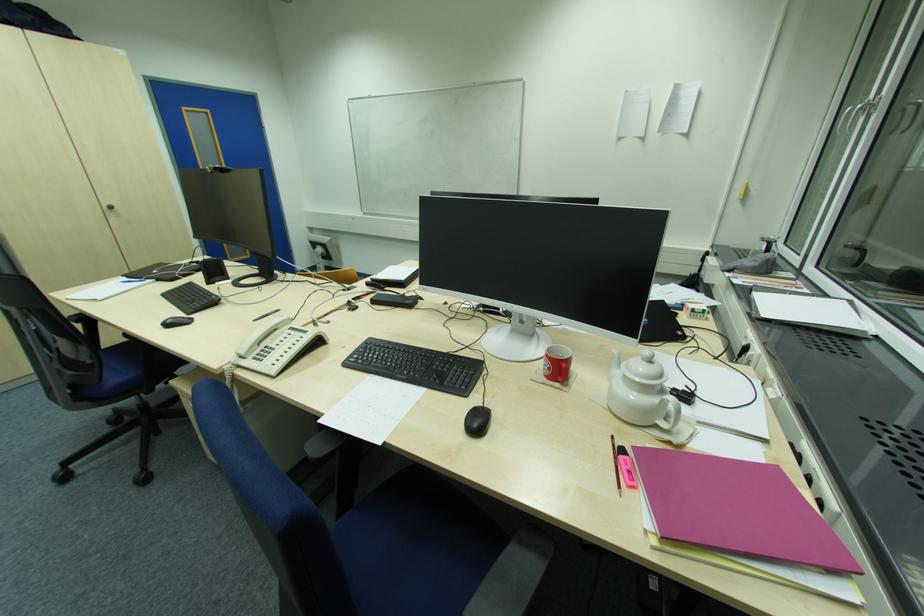
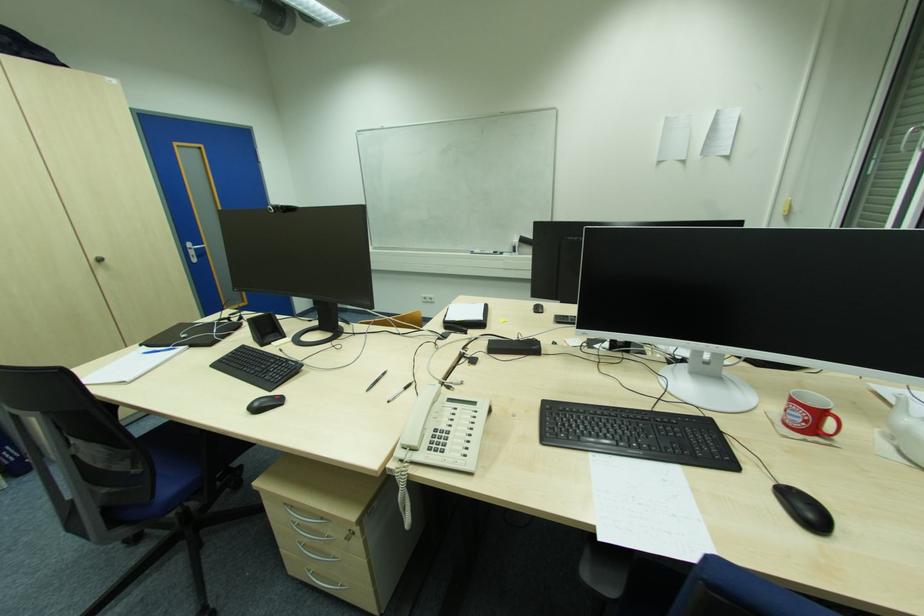
Question: The camera is either moving clockwise (left) or counter-clockwise (right) around the object. The first image is from the beginning of the video and the second image is from the end. Is the camera moving left or right when shooting the video?

Choices:
 (A) Left
 (B) Right

Answer: (A)